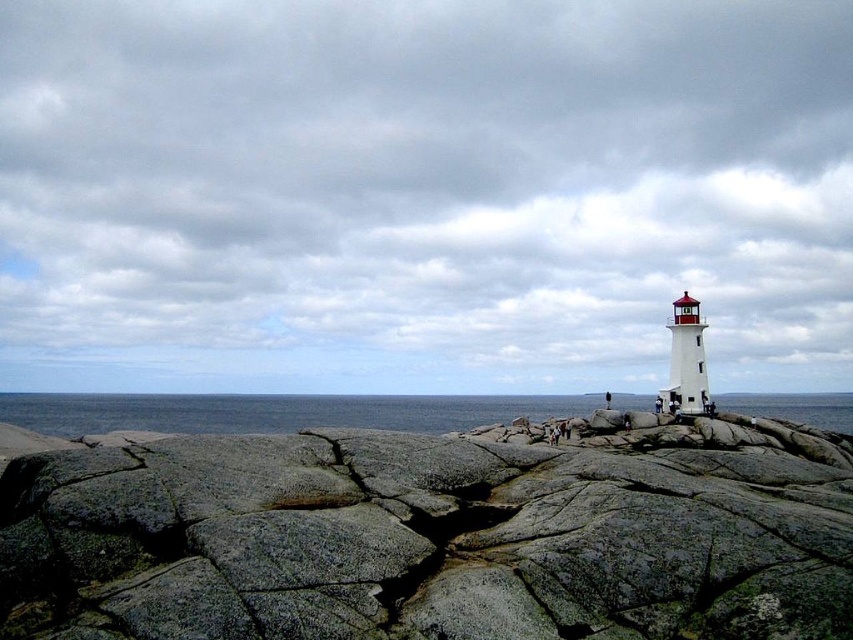
You are standing on the rocky outcrop and want to take a photo of the blue water at center. To ensure the white painted lighthouse at right is also in the frame, which direction should you move? Please explain your reasoning.

You should move to the left because the white painted lighthouse at right is to the right of the blue water at center. By moving left, you can position yourself so both the blue water at center and the lighthouse are within the camera frame.

You are standing at the point marked by the coordinates point (428, 536) on the image. What object are you standing on?

You are standing on the gray rock at center, as the coordinates point (428, 536) represent this object.

You are a photographer standing at the camera position. You want to capture a photo of the white painted lighthouse at right. If your camera has a maximum zoom range of 50 meters, can you clearly capture the lighthouse in your photo?

The distance between the white painted lighthouse at right and the camera is 52.63 meters. Since the camera can only zoom up to 50 meters, it cannot clearly capture the lighthouse at this distance.